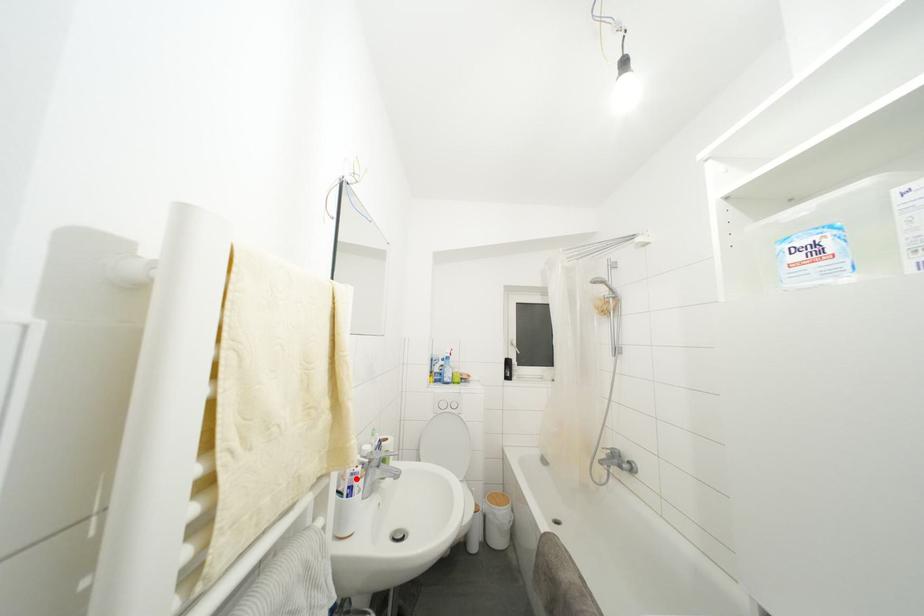
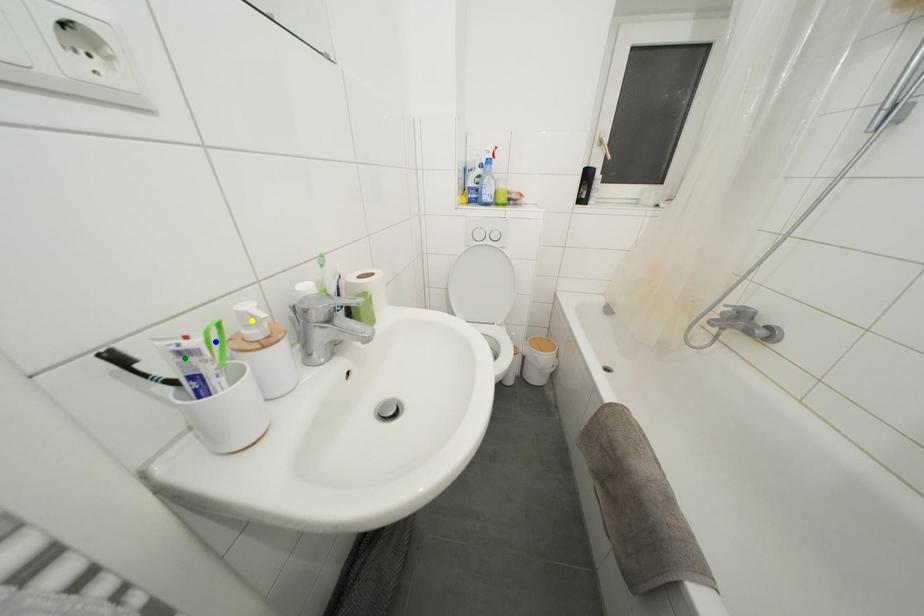
Question: I am providing you with two images of the same scene from different viewpoints. A red point is marked on the first image. You are given multiple points on the second image. Which point in image 2 is actually the same real-world point as the red point in image 1?

Choices:
 (A) blue point
 (B) yellow point
 (C) green point

Answer: (C)